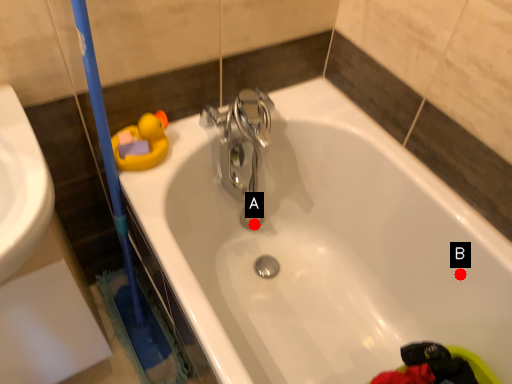
Question: Two points are circled on the image, labeled by A and B beside each circle. Among these points, which one is farthest from the camera?

Choices:
 (A) A is further
 (B) B is further

Answer: (A)